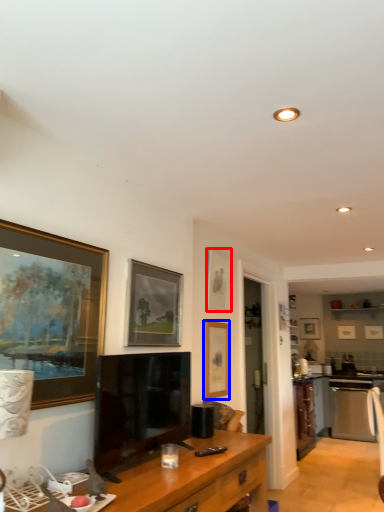
Question: Which point is further to the camera, picture frame (highlighted by a red box) or picture frame (highlighted by a blue box)?

Choices:
 (A) picture frame
 (B) picture frame

Answer: (A)